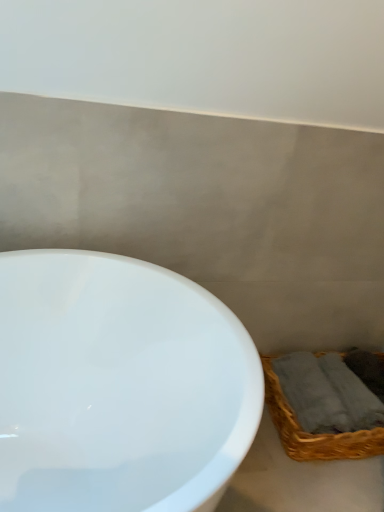
The height and width of the screenshot is (512, 384). Identify the location of woven brown basket at lower right. (314, 435).

This screenshot has height=512, width=384. What do you see at coordinates (314, 435) in the screenshot? I see `woven brown basket at lower right` at bounding box center [314, 435].

Locate an element on the screen. This screenshot has width=384, height=512. woven brown basket at lower right is located at coordinates (314, 435).